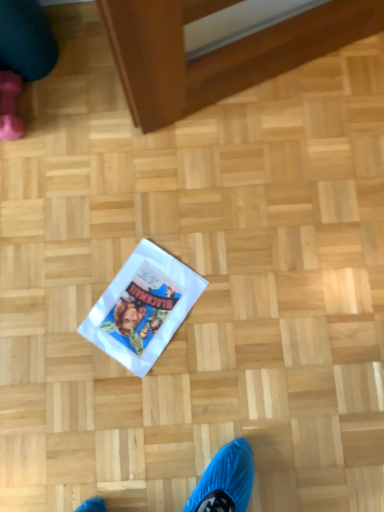
Find the location of `vacant area in front of teal fabric leg at upper left`. vacant area in front of teal fabric leg at upper left is located at coordinates (63, 116).